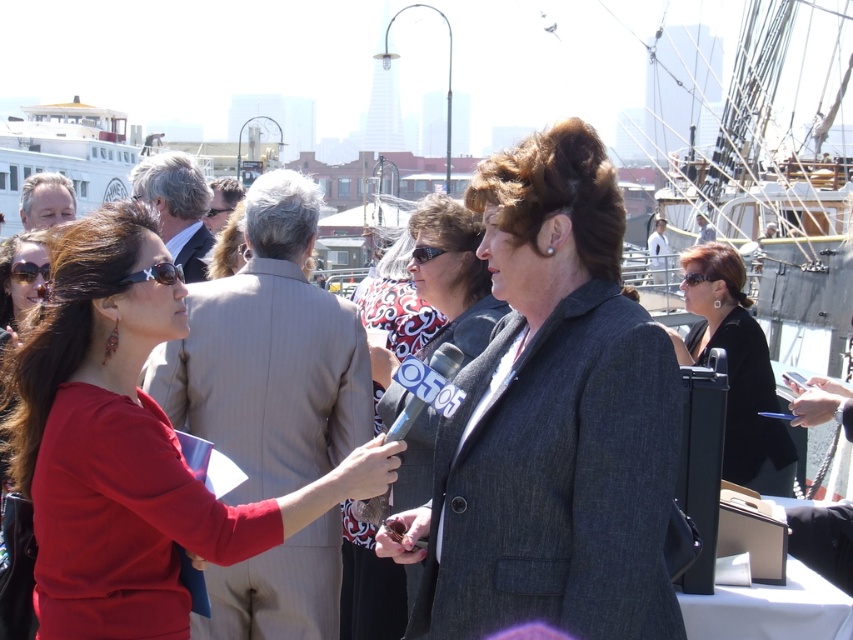
You are a photographer trying to capture a photo of the white wooden ship at upper left and the white cotton shirt at center. Given their sizes, which object should you focus on to ensure it fits entirely within the camera frame?

The white cotton shirt at center should be focused on because the white wooden ship at upper left is larger and might not fit entirely within the camera frame.

You are standing at the point marked as point (490, 296) in the image. The ship docked nearby has a height of 20 meters. Can you see the top of the ship from your current position?

The distance of point (490, 296) from camera is 57.90 meters. Since the ship is only 20 meters tall and you are 57.90 meters away from it, the top of the ship might not be visible due to the curvature of the Earth or obstructions, but based on the given information, the height of the ship is less than the distance, so theoretically, the top should be visible. However, without knowing the exact line of sight or any obstacles, it is uncertain. The answer cannot be definitively determined with the provided.